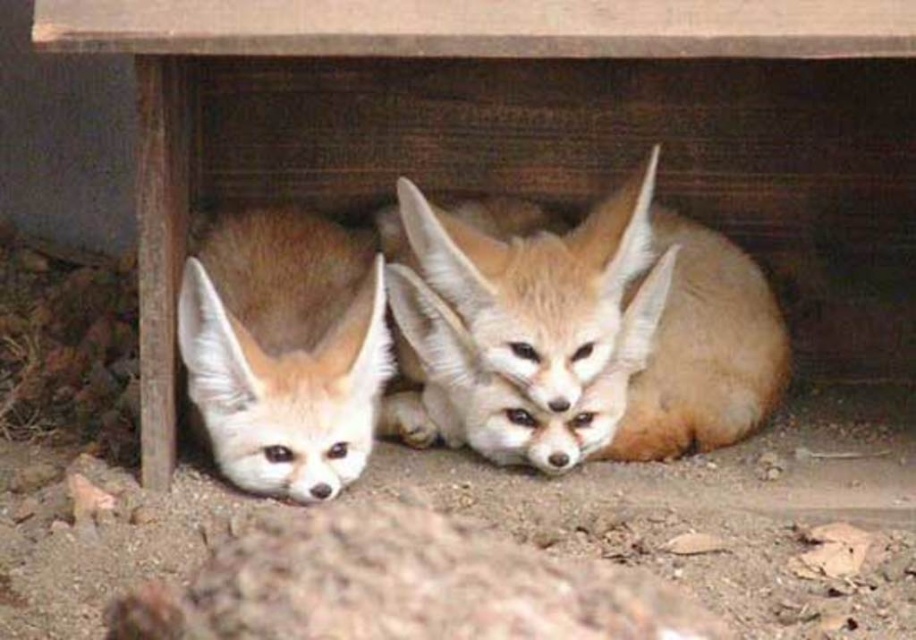
Can you confirm if light brown fur at center is bigger than fuzzy brown fox at lower left?

Indeed, light brown fur at center has a larger size compared to fuzzy brown fox at lower left.

Can you confirm if light brown fur at center is wider than fuzzy brown fox at lower left?

Indeed, light brown fur at center has a greater width compared to fuzzy brown fox at lower left.

Is point (606, 348) farther from viewer compared to point (340, 410)?

Yes, point (606, 348) is behind point (340, 410).

Identify the location of light brown fur at center. (604, 308).